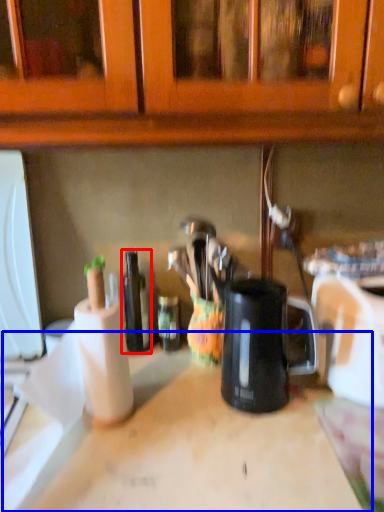
Question: Which object appears closest to the camera in this image, bottle (highlighted by a red box) or counter top (highlighted by a blue box)?

Choices:
 (A) bottle
 (B) counter top

Answer: (B)